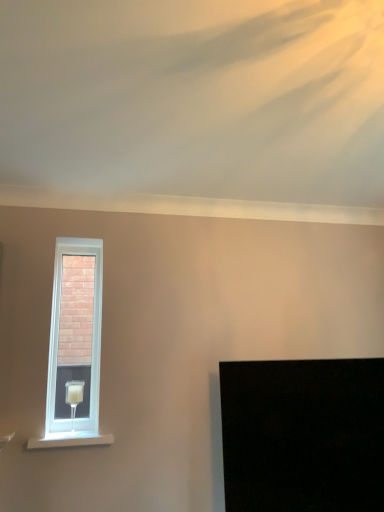
Identify the location of vacant area on top of white painted wood at lower left (from a real-world perspective). The height and width of the screenshot is (512, 384). (70, 436).